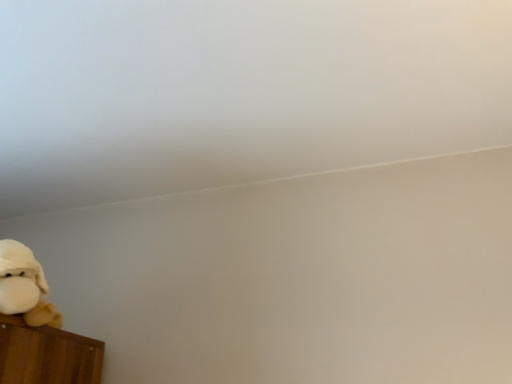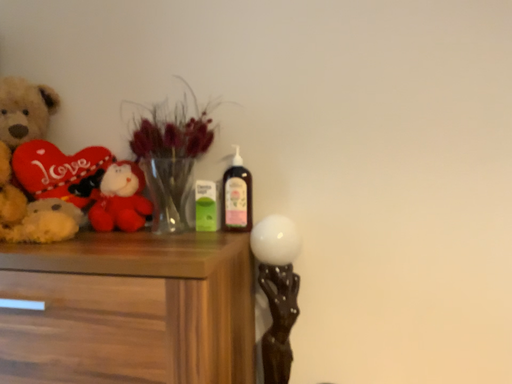
Question: How did the camera likely rotate when shooting the video?

Choices:
 (A) rotated downward
 (B) rotated upward

Answer: (A)